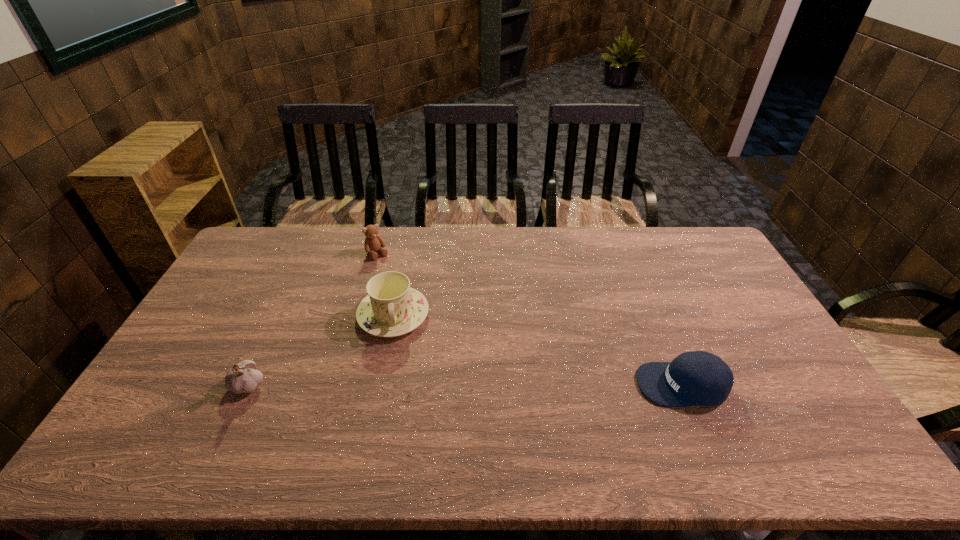
Select which object is the third closest to the leftmost object. Please provide its 2D coordinates. Your answer should be formatted as a tuple, i.e. [(x, y)], where the tuple contains the x and y coordinates of a point satisfying the conditions above.

[(693, 378)]

Select which object is the closest to the baseball cap. Please provide its 2D coordinates. Your answer should be formatted as a tuple, i.e. [(x, y)], where the tuple contains the x and y coordinates of a point satisfying the conditions above.

[(391, 308)]

This screenshot has height=540, width=960. Find the location of `vacant region that satisfies the following two spatial constraints: 1. on the back side of the leftmost object; 2. on the left side of the chinaware`. vacant region that satisfies the following two spatial constraints: 1. on the back side of the leftmost object; 2. on the left side of the chinaware is located at coordinates (281, 315).

Where is `free space that satisfies the following two spatial constraints: 1. on the front side of the garlic; 2. on the front-facing side of the rightmost object`? The width and height of the screenshot is (960, 540). free space that satisfies the following two spatial constraints: 1. on the front side of the garlic; 2. on the front-facing side of the rightmost object is located at coordinates [x=249, y=384].

Find the location of a particular element. This screenshot has height=540, width=960. vacant space that satisfies the following two spatial constraints: 1. on the front side of the baseball cap; 2. on the front-facing side of the farthest object is located at coordinates (341, 384).

Where is `vacant space that satisfies the following two spatial constraints: 1. on the back side of the garlic; 2. on the right side of the second farthest object`? vacant space that satisfies the following two spatial constraints: 1. on the back side of the garlic; 2. on the right side of the second farthest object is located at coordinates (281, 315).